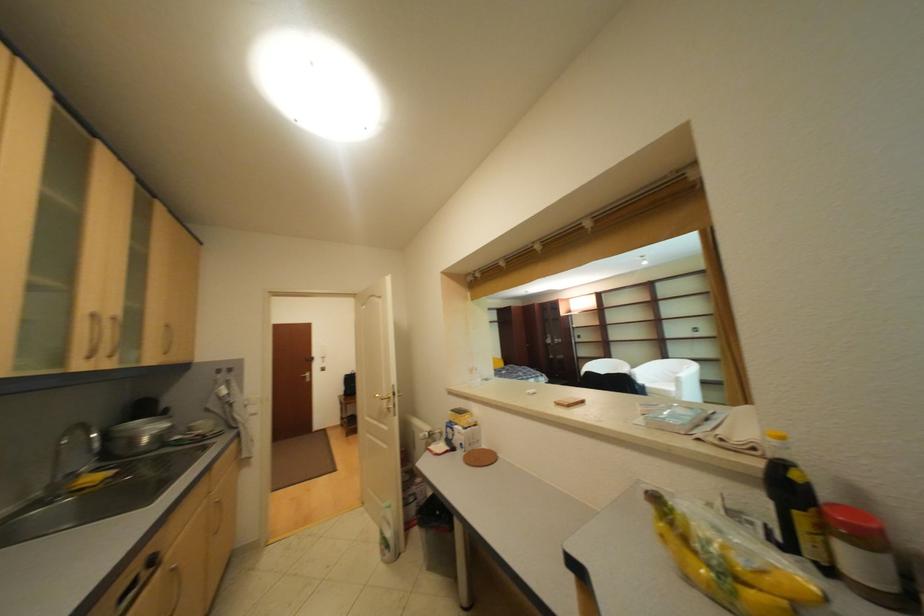
Where would you lift the cardboard box? Please return your answer as a coordinate pair (x, y).

(462, 436)